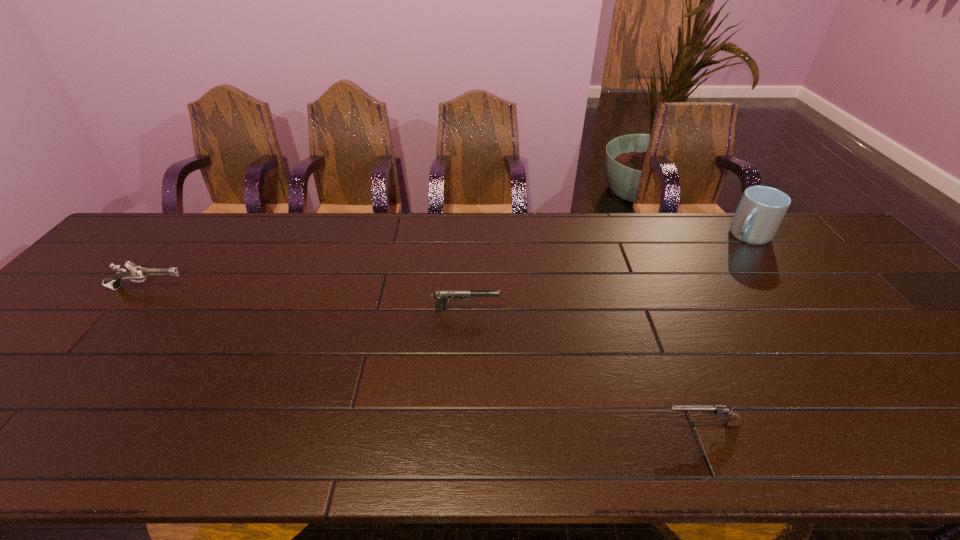
Locate an element on the screen. This screenshot has width=960, height=540. blank area located 0.380m at the muzzle end of the second gun from left to right is located at coordinates (643, 309).

Image resolution: width=960 pixels, height=540 pixels. I want to click on vacant region located 0.310m aiming along the barrel of the second object from right to left, so click(512, 425).

Identify the location of free space located aiming along the barrel of the second object from right to left. The height and width of the screenshot is (540, 960). (556, 425).

The height and width of the screenshot is (540, 960). I want to click on vacant space located aiming along the barrel of the second object from right to left, so click(605, 425).

Where is `object that is at the far edge`? object that is at the far edge is located at coordinates (761, 209).

This screenshot has width=960, height=540. What are the coordinates of `object that is at the near edge` in the screenshot? It's located at (734, 421).

Locate an element on the screen. This screenshot has height=540, width=960. object located in the left edge section of the desktop is located at coordinates (133, 272).

You are a GUI agent. You are given a task and a screenshot of the screen. Output one action in this format:
    pyautogui.click(x=<x>, y=<y>)
    Task: Click on the vacant point at the far edge
    The image size is (960, 540).
    Given the screenshot: What is the action you would take?
    pyautogui.click(x=373, y=251)

What are the coordinates of `free region at the near edge of the desktop` in the screenshot? It's located at (871, 426).

The height and width of the screenshot is (540, 960). In the image, there is a desktop. What are the coordinates of `vacant space at the left edge` in the screenshot? It's located at (92, 301).